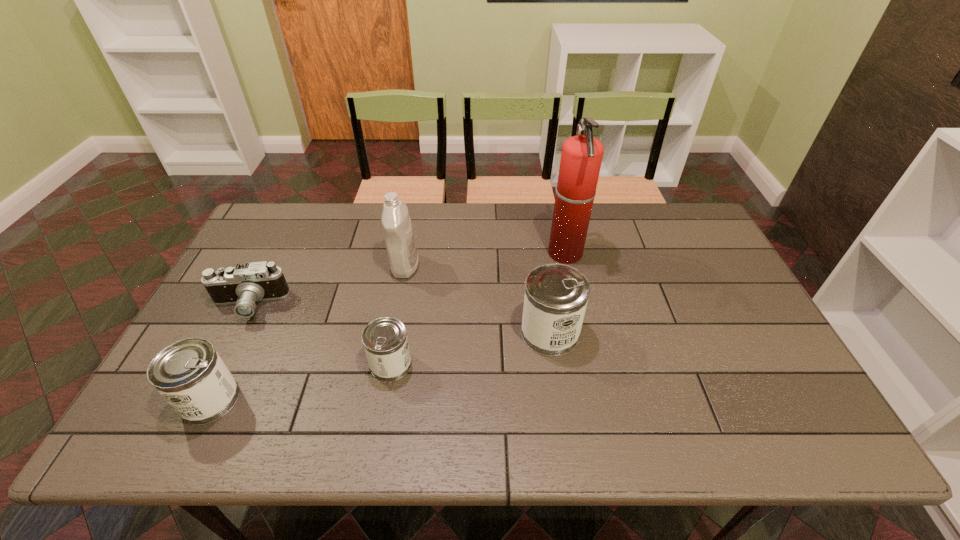
Locate an element on the screen. free space at the far edge of the desktop is located at coordinates (412, 210).

Identify the location of vacant position at the near edge of the desktop. (273, 392).

This screenshot has width=960, height=540. I want to click on vacant space at the right edge, so click(712, 282).

You are a GUI agent. You are given a task and a screenshot of the screen. Output one action in this format:
    pyautogui.click(x=<x>, y=<y>)
    Task: Click on the vacant space at the far left corner of the desktop
    This screenshot has width=960, height=540.
    Given the screenshot: What is the action you would take?
    pyautogui.click(x=285, y=228)

In order to click on vacant area that lies between the camera and the detergent in this screenshot , I will do `click(326, 286)`.

Locate an element on the screen. The image size is (960, 540). free area in between the second can from right to left and the second tallest object is located at coordinates (398, 315).

I want to click on vacant area that lies between the rightmost can and the camera, so click(x=399, y=319).

Locate an element on the screen. Image resolution: width=960 pixels, height=540 pixels. free space between the fourth tallest object and the fifth shortest object is located at coordinates (307, 333).

The image size is (960, 540). In order to click on free spot between the detergent and the third shortest object in this screenshot , I will do `click(307, 333)`.

Where is `empty location between the leftmost can and the second can from right to left`? empty location between the leftmost can and the second can from right to left is located at coordinates (300, 382).